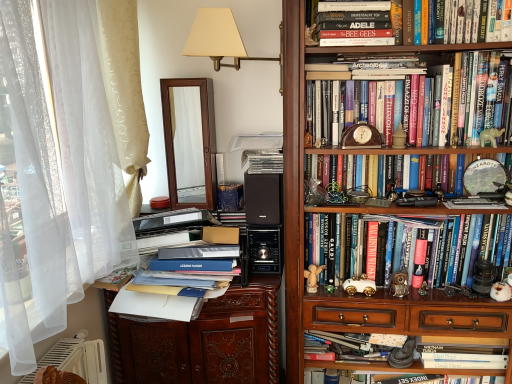
Describe the element at coordinates (355, 25) in the screenshot. I see `hardcover book at upper center, which is the fifth book in bottom-to-top order` at that location.

The image size is (512, 384). What do you see at coordinates (263, 199) in the screenshot?
I see `black matte speaker at center` at bounding box center [263, 199].

Identify the location of hardcover book at upper center, the 2th book positioned from the top. (355, 25).

Is wooden carved file cabinet at center smaller than hardcover book at upper center, placed as the sixth book when sorted from bottom to top?

No.

Considering the sizes of objects wooden carved file cabinet at center and hardcover book at upper center, placed as the sixth book when sorted from bottom to top, in the image provided, who is wider, wooden carved file cabinet at center or hardcover book at upper center, placed as the sixth book when sorted from bottom to top,?

With larger width is wooden carved file cabinet at center.

Is wooden carved file cabinet at center shorter than hardcover book at upper center, placed as the 1th book when sorted from top to bottom?

No, wooden carved file cabinet at center is not shorter than hardcover book at upper center, placed as the 1th book when sorted from top to bottom.

Could you measure the distance between wooden angel at center, positioned as the 1th toy in left-to-right order, and hardcover book at center, which is the 3th book in top-to-bottom order?

They are 29.35 inches apart.

Which object is positioned more to the left, wooden angel at center, positioned as the 1th toy in left-to-right order, or hardcover book at center, which is the 3th book in top-to-bottom order?

wooden angel at center, positioned as the 1th toy in left-to-right order.

Which is in front, wooden angel at center, which appears as the third toy when ordered from the bottom, or hardcover book at center, which is the 3th book in top-to-bottom order?

Positioned in front is hardcover book at center, which is the 3th book in top-to-bottom order.

From a real-world perspective, who is located lower, wooden angel at center, marked as the 4th toy in a right-to-left arrangement, or hardcover book at center, which is the 3th book in top-to-bottom order?

wooden angel at center, marked as the 4th toy in a right-to-left arrangement, is physically lower.

Is green plastic elephant at upper right, positioned as the first toy in top-to-bottom order, placed right next to hardcover book at center, which is the fifth book from top to bottom?

green plastic elephant at upper right, positioned as the first toy in top-to-bottom order, and hardcover book at center, which is the fifth book from top to bottom, are not in contact.

Considering the relative positions of green plastic elephant at upper right, which is counted as the 4th toy, starting from the bottom, and hardcover book at center, the 2th book from the bottom, in the image provided, is green plastic elephant at upper right, which is counted as the 4th toy, starting from the bottom, to the left or to the right of hardcover book at center, the 2th book from the bottom,?

Based on their positions, green plastic elephant at upper right, which is counted as the 4th toy, starting from the bottom, is located to the right of hardcover book at center, the 2th book from the bottom.

Based on the photo, would you say green plastic elephant at upper right, which is counted as the 4th toy, starting from the bottom, contains hardcover book at center, which is the fifth book from top to bottom?

No, hardcover book at center, which is the fifth book from top to bottom, is located outside of green plastic elephant at upper right, which is counted as the 4th toy, starting from the bottom.

From a real-world perspective, is green plastic elephant at upper right, positioned as the first toy in top-to-bottom order, over hardcover book at center, the 2th book from the bottom?

Yes, from a real-world perspective, green plastic elephant at upper right, positioned as the first toy in top-to-bottom order, is on top of hardcover book at center, the 2th book from the bottom.

Does point (349, 2) come closer to viewer compared to point (213, 37)?

Yes, it is.

Can you confirm if hardcover book at upper center, placed as the sixth book when sorted from bottom to top, is positioned to the right of beige fabric lampshade at upper center?

Correct, you'll find hardcover book at upper center, placed as the sixth book when sorted from bottom to top, to the right of beige fabric lampshade at upper center.

Is hardcover book at upper center, placed as the sixth book when sorted from bottom to top, facing away from beige fabric lampshade at upper center?

That's not correct — hardcover book at upper center, placed as the sixth book when sorted from bottom to top, is not looking away from beige fabric lampshade at upper center.

Considering the relative positions of hardcover book at upper center, placed as the 1th book when sorted from top to bottom, and beige fabric lampshade at upper center in the image provided, is hardcover book at upper center, placed as the 1th book when sorted from top to bottom, in front of beige fabric lampshade at upper center?

Yes, it is in front of beige fabric lampshade at upper center.

Can you tell me how much metallic owl at center-right, which is the third toy from left to right, and hardcover book at upper center, placed as the 1th book when sorted from top to bottom, differ in facing direction?

They differ by 42.7 degrees in their facing directions.

Between point (398, 297) and point (444, 1), which one is positioned behind?

Point (398, 297)

Is metallic owl at center-right, acting as the second toy starting from the right, touching hardcover book at upper center, placed as the 1th book when sorted from top to bottom?

metallic owl at center-right, acting as the second toy starting from the right, is not next to hardcover book at upper center, placed as the 1th book when sorted from top to bottom, and they're not touching.

From the image's perspective, is metallic owl at center-right, positioned as the third toy in top-to-bottom order, above or below hardcover book at upper center, placed as the sixth book when sorted from bottom to top?

Based on their image positions, metallic owl at center-right, positioned as the third toy in top-to-bottom order, is located beneath hardcover book at upper center, placed as the sixth book when sorted from bottom to top.

Between hardcover book at upper center, the 2th book positioned from the top, and wooden-framed mirror at center, which one appears on the right side from the viewer's perspective?

Positioned to the right is hardcover book at upper center, the 2th book positioned from the top.

From the image's perspective, is hardcover book at upper center, which is the fifth book in bottom-to-top order, over wooden-framed mirror at center?

Yes, from the image's perspective, hardcover book at upper center, which is the fifth book in bottom-to-top order, is on top of wooden-framed mirror at center.

Can you tell me how much hardcover book at upper center, the 2th book positioned from the top, and wooden-framed mirror at center differ in facing direction?

hardcover book at upper center, the 2th book positioned from the top, and wooden-framed mirror at center are facing 1.38 degrees away from each other.

From a real-world perspective, is hardcover book at upper center, the 2th book positioned from the top, above or below wooden-framed mirror at center?

From a real-world perspective, hardcover book at upper center, the 2th book positioned from the top, is physically above wooden-framed mirror at center.

Consider the image. Based on their sizes in the image, would you say hardcover book at upper center, the 2th book positioned from the top, is bigger or smaller than wooden angel at center, positioned as the 1th toy in left-to-right order?

hardcover book at upper center, the 2th book positioned from the top, is bigger than wooden angel at center, positioned as the 1th toy in left-to-right order.

Which object is further away from the camera, hardcover book at upper center, which is the fifth book in bottom-to-top order, or wooden angel at center, positioned as the 1th toy in left-to-right order?

wooden angel at center, positioned as the 1th toy in left-to-right order, is behind.

Which book is the 6th one when counting from the right side of the wooden carved file cabinet at center? Please provide its 2D coordinates.

[(410, 22)]

Find the location of `the 2nd toy below the hardcover book at center, which is the 3th book in top-to-bottom order (from the image's perspective)`. the 2nd toy below the hardcover book at center, which is the 3th book in top-to-bottom order (from the image's perspective) is located at coordinates (313, 277).

Which object lies further to the anchor point black matte speaker at center, hardcover book at center, which is the fifth book from top to bottom, or blue matte book at center, which is the 2th paperback book in bottom-to-top order?

Based on the image, hardcover book at center, which is the fifth book from top to bottom, appears to be further to black matte speaker at center.

When comparing their distances from wooden bookshelf at upper right, does wooden angel at center, which ranks as the second toy in top-to-bottom order, or hardcover book at upper center, the 2th book positioned from the top, seem closer?

Based on the image, hardcover book at upper center, the 2th book positioned from the top, appears to be nearer to wooden bookshelf at upper right.

Based on their spatial positions, is wooden bookshelf at upper right or metallic owl at center-right, which is the third toy from left to right, further from hardcover book at center, which is the 3th book in top-to-bottom order?

metallic owl at center-right, which is the third toy from left to right, is positioned further to the anchor hardcover book at center, which is the 3th book in top-to-bottom order.

Estimate the real-world distances between objects in this image. Which object is further from beige fabric lampshade at upper center, hardcover book at upper center, which is the fifth book in bottom-to-top order, or silver metallic cd case at center, marked as the 4th book in a top-to-bottom arrangement?

silver metallic cd case at center, marked as the 4th book in a top-to-bottom arrangement.

When comparing their distances from blue matte book at center, which is the 2th paperback book in bottom-to-top order, does beige fabric lampshade at upper center or black matte speaker at center seem closer?

black matte speaker at center is closer to blue matte book at center, which is the 2th paperback book in bottom-to-top order.

Looking at the image, which one is located further to wooden bookshelf at upper right, hardcover book at center, which is counted as the first book, starting from the bottom, or blue matte book at center, which is the 1th paperback book from bottom to top?

Result: blue matte book at center, which is the 1th paperback book from bottom to top, lies further to wooden bookshelf at upper right than the other object.

From the image, which object appears to be farther from blue matte book at center, acting as the second paperback book starting from the top, wooden-framed mirror at center or beige fabric lampshade at upper center?

Among the two, beige fabric lampshade at upper center is located further to blue matte book at center, acting as the second paperback book starting from the top.

Estimate the real-world distances between objects in this image. Which object is further from blue matte book at center, which is the 1th paperback book from bottom to top, white glossy toy car at center, the third toy when ordered from right to left, or black matte speaker at center?

Based on the image, white glossy toy car at center, the third toy when ordered from right to left, appears to be further to blue matte book at center, which is the 1th paperback book from bottom to top.

At what (x,y) coordinates should I click in order to perform the action: click on lamp between hardcover book at upper center, which is the fifth book in bottom-to-top order, and black matte speaker at center vertically. Please return your answer as a coordinate pair (x, y). This screenshot has height=384, width=512. Looking at the image, I should click on (218, 39).

Locate an element on the screen. This screenshot has height=384, width=512. speaker between silver metallic cd case at center, which is the 3th book from bottom to top, and wooden bookshelf at upper right, in the horizontal direction is located at coordinates (263, 199).

Image resolution: width=512 pixels, height=384 pixels. I want to click on lamp that lies between hardcover book at upper center, the 2th book positioned from the top, and hardcover book at center, the 6th book when ordered from top to bottom, from top to bottom, so click(218, 39).

The width and height of the screenshot is (512, 384). Find the location of `file cabinet situated between wooden-framed mirror at center and green plastic elephant at upper right, which is counted as the 1th toy, starting from the right, from left to right`. file cabinet situated between wooden-framed mirror at center and green plastic elephant at upper right, which is counted as the 1th toy, starting from the right, from left to right is located at coordinates (202, 340).